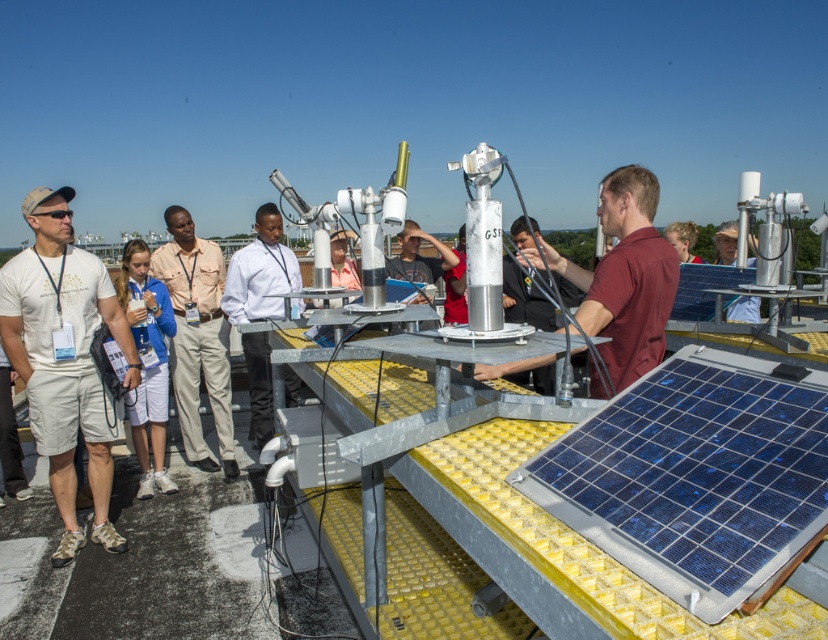
Can you confirm if white cotton t-shirt at left is bigger than white shirt at center?

Incorrect, white cotton t-shirt at left is not larger than white shirt at center.

Is white cotton t-shirt at left positioned at the back of white shirt at center?

No, white cotton t-shirt at left is in front of white shirt at center.

Locate an element on the screen. The image size is (828, 640). white cotton t-shirt at left is located at coordinates (65, 358).

Between white shirt at center and matte gray shirt at center, which one has less height?

matte gray shirt at center is shorter.

Can you confirm if white shirt at center is smaller than matte gray shirt at center?

No, white shirt at center is not smaller than matte gray shirt at center.

Between point (283, 275) and point (415, 275), which one is positioned behind?

The point (415, 275) is more distant.

Find the location of a particular element. This screenshot has height=640, width=828. white shirt at center is located at coordinates (260, 273).

Based on the photo, is tan/leather shirt at center behind white shirt at center?

Yes, it is behind white shirt at center.

Measure the distance between point (183, 362) and camera.

They are 4.79 meters apart.

Identify the location of tan/leather shirt at center. (196, 337).